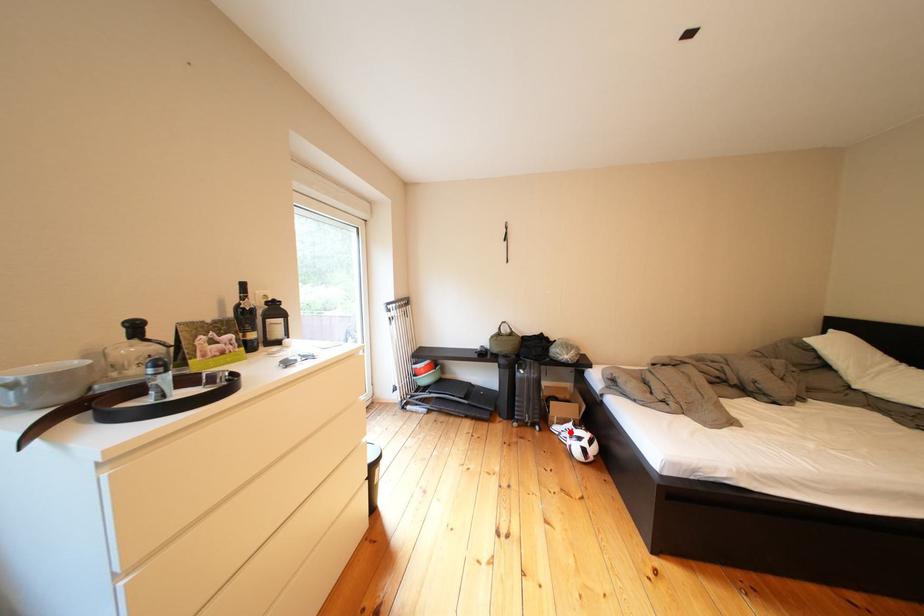
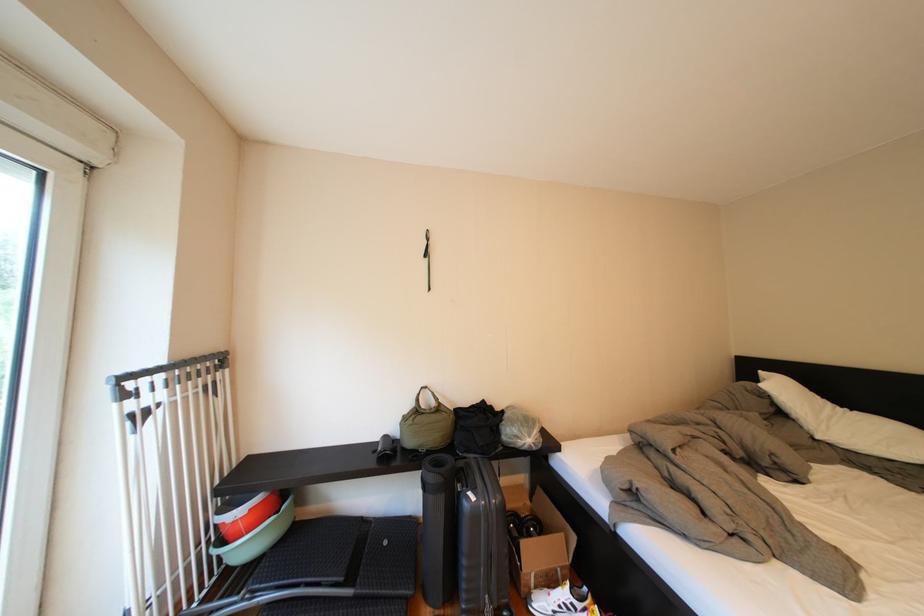
In the second image, find the point that corresponds to the highlighted location in the first image.

(554, 609)